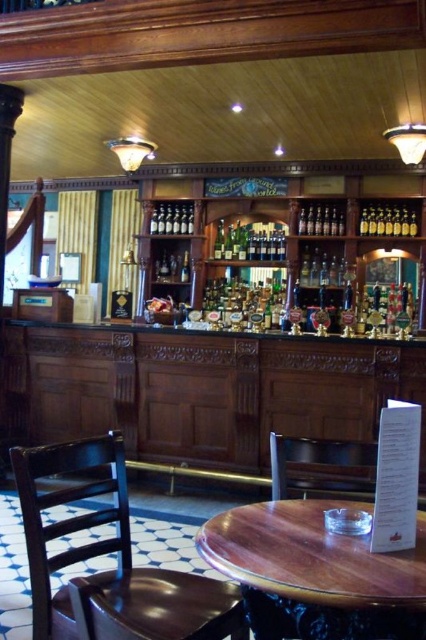
You are a customer in the pub and want to place your drink on the wooden round table at center. However, you notice the shiny silver bottles at center are already on the table. Can you still place your drink there without it being blocked by the bottles?

The wooden round table at center has a lesser height compared to shiny silver bottles at center, so the bottles might block the space needed for placing your drink. Consider moving the bottles or choosing another spot on the table that is not obstructed.

You are a customer at the pub and want to sit at the wooden round table at center. The bartender tells you that the table is located at point (316, 573) in the image. Can you confirm if this coordinate is correct based on the description?

Yes, the coordinate point (316, 573) corresponds to the wooden round table at center as described.

You are a customer sitting at the wooden round table at center, and you want to grab a bottle from the shiny gold bottles at upper right. Can you reach them without leaving your seat?

The wooden round table at center is in front of the shiny gold bottles at upper right, meaning the bottles are behind the table. Since you are sitting at the table, you are already facing away from the bottles, so you would need to get up to reach them.